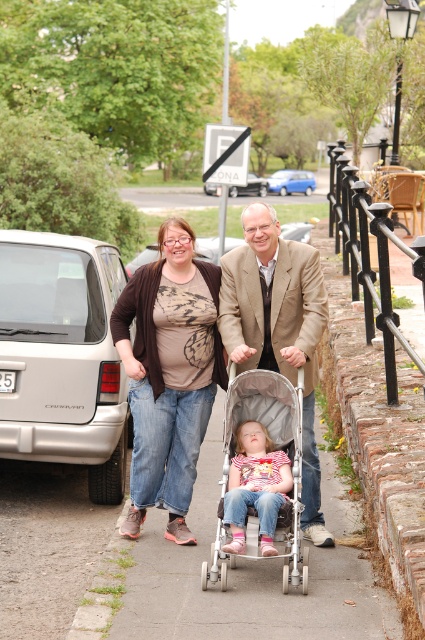
You are a pedestrian standing on the paved pathway and want to cross to the other side. The silver metallic stroller at center and the silver metallic sedan at center are both in your path. Which object is closer to you, requiring you to navigate around first?

The silver metallic stroller at center is closer to you because it is located below the silver metallic sedan at center, meaning it is positioned lower in the image and thus nearer to the observer.

You are standing at the origin point in the park scene. The silver metallic stroller at center is located at point (x=274, y=449). If you want to walk directly to the stroller, which direction should you head?

The silver metallic stroller at center is located at point (x=274, y=449), so you should head towards that coordinate to reach it directly.

You are a pedestrian standing on the paved pathway and see the silver metallic van at left and the brown cardigan at center. Which object is higher from the ground?

The silver metallic van at left is higher from the ground than the brown cardigan at center.